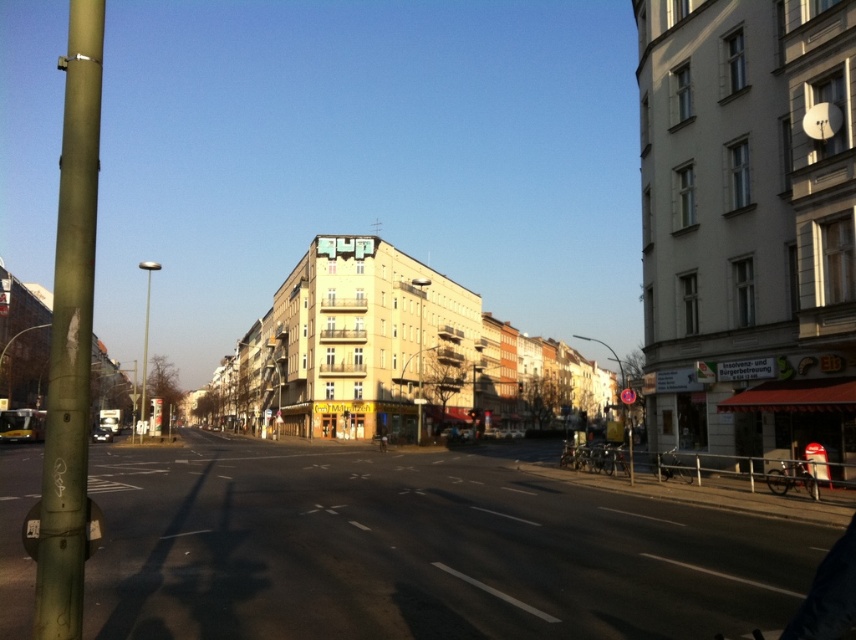
Which is more to the left, green matte pole at left or metallic reflective sign at center?

green matte pole at left

Between point (99, 42) and point (617, 364), which one is positioned in front?

Point (99, 42) is more forward.

Locate an element on the screen. This screenshot has height=640, width=856. green matte pole at left is located at coordinates (70, 336).